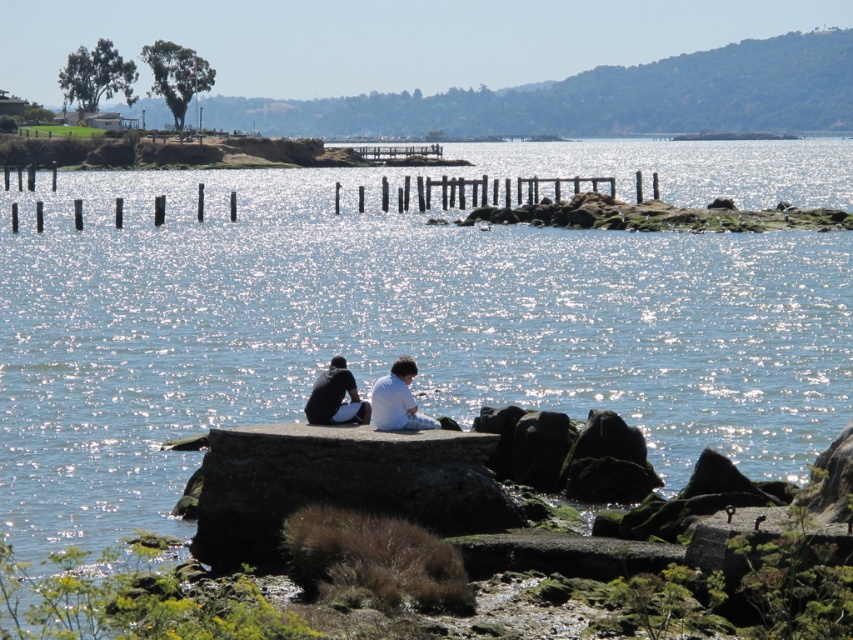
Question: Which object is farther from the camera taking this photo?

Choices:
 (A) white fabric couple at center
 (B) white matte shirt at center
 (C) dark gray fabric shirt at lower center

Answer: (C)

Question: Is white fabric couple at center positioned at the back of white matte shirt at center?

Choices:
 (A) yes
 (B) no

Answer: (B)

Question: Which is nearer to the dark gray fabric shirt at lower center?

Choices:
 (A) white fabric couple at center
 (B) white matte shirt at center

Answer: (A)

Question: Which is farther from the white fabric couple at center?

Choices:
 (A) dark gray fabric shirt at lower center
 (B) white matte shirt at center

Answer: (A)

Question: Is white matte shirt at center wider than dark gray fabric shirt at lower center?

Choices:
 (A) no
 (B) yes

Answer: (B)

Question: Observing the image, what is the correct spatial positioning of white matte shirt at center in reference to dark gray fabric shirt at lower center?

Choices:
 (A) above
 (B) below

Answer: (B)